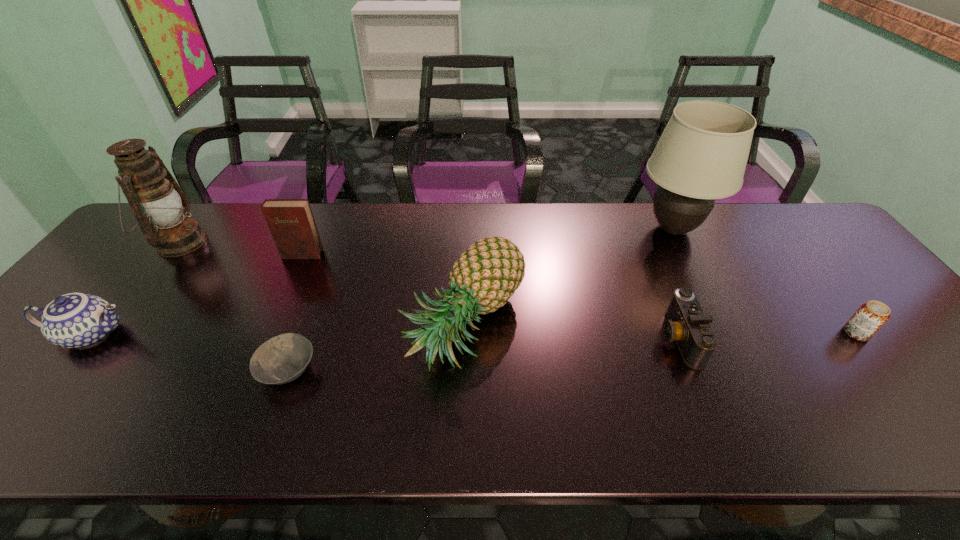
Where is `free spot that satisfies the following two spatial constraints: 1. on the front side of the beer can; 2. on the right side of the lantern`? This screenshot has width=960, height=540. free spot that satisfies the following two spatial constraints: 1. on the front side of the beer can; 2. on the right side of the lantern is located at coordinates (109, 333).